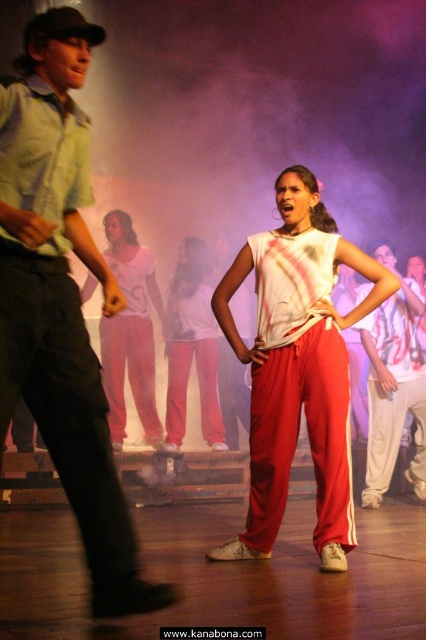
Does matte red track pants at center have a greater height compared to white matte pants at center?

Incorrect, matte red track pants at center's height is not larger of white matte pants at center's.

Who is shorter, matte red track pants at center or white matte pants at center?

Standing shorter between the two is matte red track pants at center.

Find the location of a particular element. matte red track pants at center is located at coordinates (296, 436).

This screenshot has width=426, height=640. Identify the location of matte red track pants at center. (296, 436).

Can you confirm if matte red track pants at center is positioned above white matte shirt at center?

No.

Who is taller, matte red track pants at center or white matte shirt at center?

Standing taller between the two is white matte shirt at center.

Who is more distant from viewer, (x=250, y=406) or (x=385, y=355)?

The point (x=385, y=355) is behind.

This screenshot has height=640, width=426. What are the coordinates of `matte red track pants at center` in the screenshot? It's located at (296, 436).

Is point (400, 288) less distant than point (385, 467)?

That is True.

Is white matte shirt at center to the right of white cotton pants at right from the viewer's perspective?

No, white matte shirt at center is not to the right of white cotton pants at right.

Which is in front, point (391, 342) or point (376, 449)?

Point (391, 342) is more forward.

You are a GUI agent. You are given a task and a screenshot of the screen. Output one action in this format:
    pyautogui.click(x=<x>, y=<y>)
    Task: Click on the white matte shirt at center
    This screenshot has height=640, width=426.
    Given the screenshot: What is the action you would take?
    pyautogui.click(x=394, y=385)